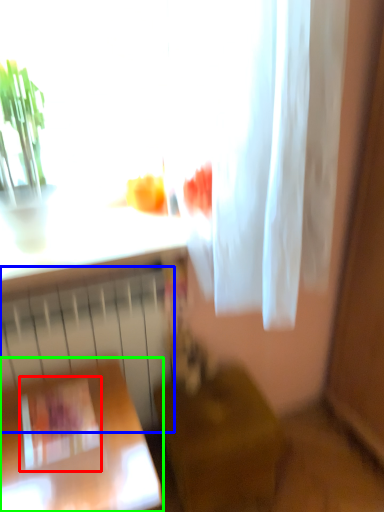
Question: Which is nearer to the square (highlighted by a red box)? radiator (highlighted by a blue box) or furniture (highlighted by a green box).

Choices:
 (A) radiator
 (B) furniture

Answer: (B)